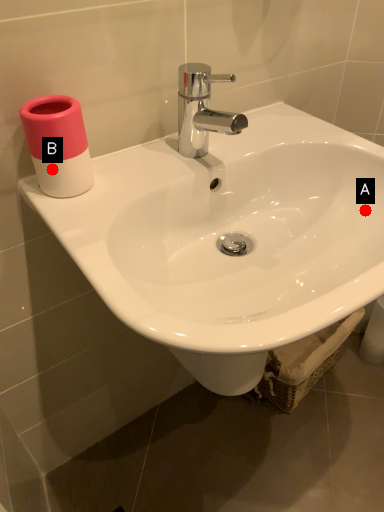
Question: Two points are circled on the image, labeled by A and B beside each circle. Which point appears farthest from the camera in this image?

Choices:
 (A) A is further
 (B) B is further

Answer: (A)